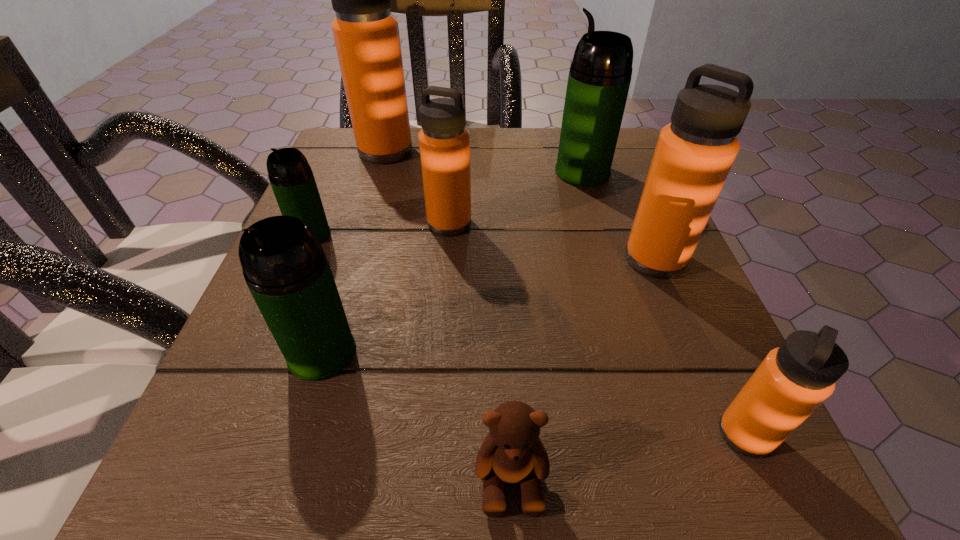
The width and height of the screenshot is (960, 540). I want to click on the biggest orange thermos bottle, so click(366, 34).

At what (x,y) coordinates should I click in order to perform the action: click on the tallest object. Please return your answer as a coordinate pair (x, y). This screenshot has width=960, height=540. Looking at the image, I should click on (366, 34).

Identify the location of the biggest green thermos bottle. Image resolution: width=960 pixels, height=540 pixels. (600, 74).

Where is `the farthest green thermos bottle`? Image resolution: width=960 pixels, height=540 pixels. the farthest green thermos bottle is located at coordinates (600, 74).

The width and height of the screenshot is (960, 540). In order to click on the second biggest orange thermos bottle in this screenshot , I will do `click(694, 154)`.

This screenshot has height=540, width=960. Identify the location of the second green thermos bottle from right to left. (285, 268).

Locate an element on the screen. The height and width of the screenshot is (540, 960). the second biggest green thermos bottle is located at coordinates (285, 268).

Identify the location of the fourth thermos bottle from left to right. The image size is (960, 540). (444, 142).

Where is `the fourth object from left to right`? The height and width of the screenshot is (540, 960). the fourth object from left to right is located at coordinates (444, 142).

The width and height of the screenshot is (960, 540). Identify the location of the second nearest green thermos bottle. (290, 175).